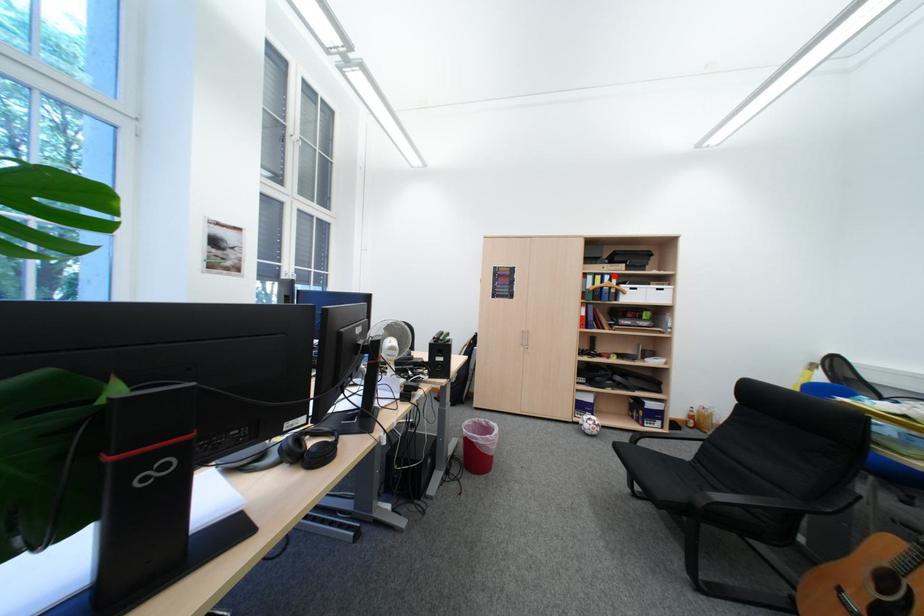
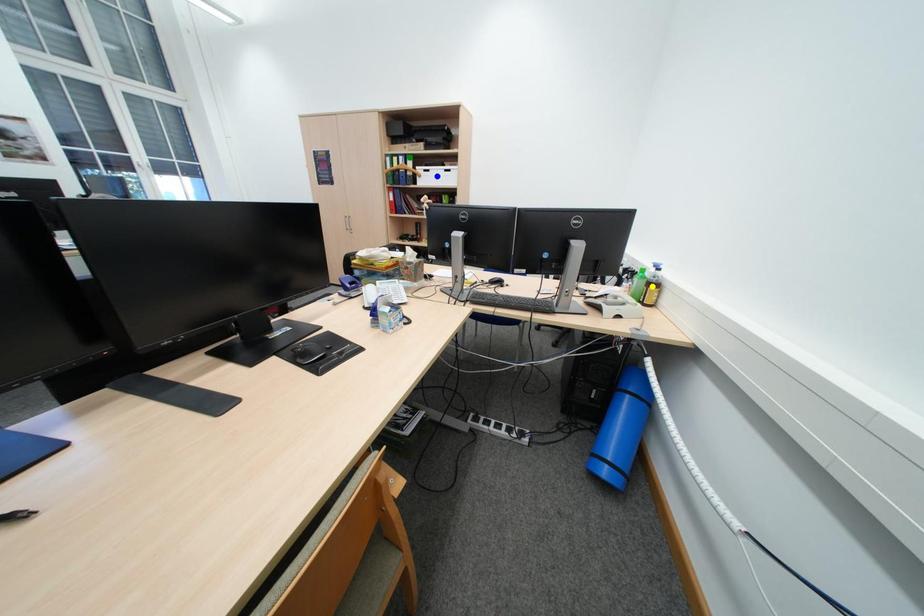
Question: I am providing you with two images of the same scene from different viewpoints. A red point is marked on the first image. You are given multiple points on the second image. Which mark in image 2 goes with the point in image 1?

Choices:
 (A) green point
 (B) yellow point
 (C) blue point

Answer: (A)